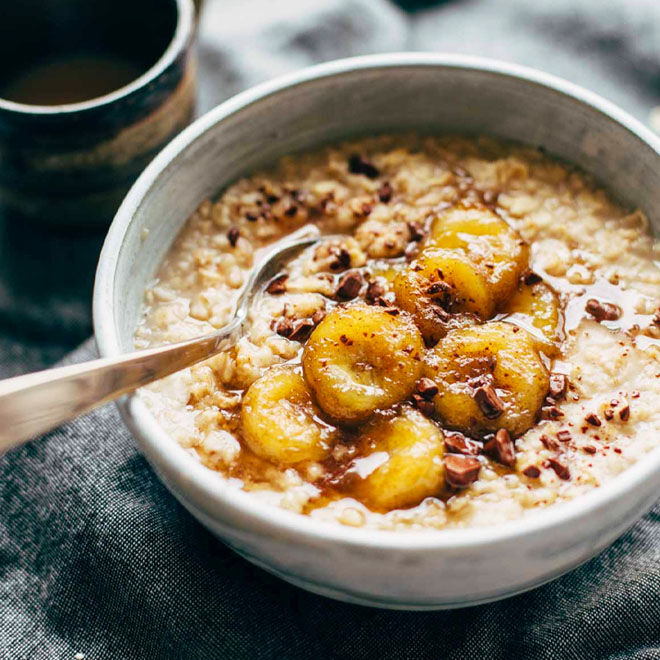
Where is `fabric`? fabric is located at coordinates tap(86, 609).